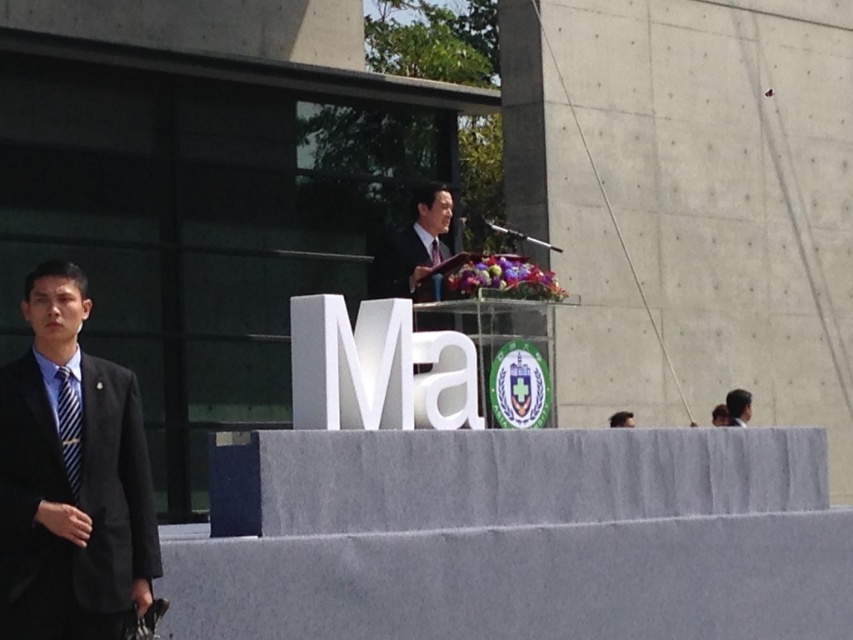
Question: Among these points, which one is nearest to the camera?

Choices:
 (A) (73, 412)
 (B) (613, 417)

Answer: (A)

Question: Can you confirm if black suit at left is positioned to the right of blue striped tie at left?

Choices:
 (A) no
 (B) yes

Answer: (A)

Question: Can you confirm if black suit at left is wider than matte black suit at center?

Choices:
 (A) yes
 (B) no

Answer: (A)

Question: Among these objects, which one is farthest from the camera?

Choices:
 (A) blue striped tie at center
 (B) matte black suit at center
 (C) black suit at left

Answer: (A)

Question: Observing the image, what is the correct spatial positioning of black suit at left in reference to black suit at upper center?

Choices:
 (A) below
 (B) above

Answer: (B)

Question: Which of the following is the closest to the observer?

Choices:
 (A) (430, 248)
 (B) (744, 390)
 (C) (74, 433)
 (D) (608, 417)

Answer: (C)